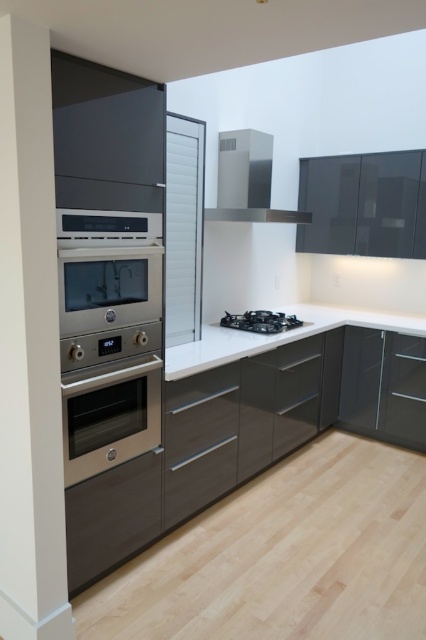
Does white glossy countertop at center appear over black matte stove at center?

No, white glossy countertop at center is not above black matte stove at center.

Consider the image. Does white glossy countertop at center have a lesser width compared to black matte stove at center?

In fact, white glossy countertop at center might be wider than black matte stove at center.

Who is more forward, [333,314] or [241,321]?

Point [241,321] is in front.

At what (x,y) coordinates should I click in order to perform the action: click on white glossy countertop at center. Please return your answer as a coordinate pair (x, y). The image size is (426, 640). Looking at the image, I should click on (276, 337).

Is point (115, 412) positioned in front of point (238, 332)?

That is True.

The width and height of the screenshot is (426, 640). Describe the element at coordinates (109, 416) in the screenshot. I see `stainless steel oven at center` at that location.

The width and height of the screenshot is (426, 640). What do you see at coordinates (109, 416) in the screenshot? I see `stainless steel oven at center` at bounding box center [109, 416].

Locate an element on the screen. The height and width of the screenshot is (640, 426). stainless steel oven at center is located at coordinates (109, 416).

Does white glossy countertop at center have a larger size compared to satin stainless steel exhaust hood at upper center?

Indeed, white glossy countertop at center has a larger size compared to satin stainless steel exhaust hood at upper center.

Who is higher up, white glossy countertop at center or satin stainless steel exhaust hood at upper center?

Positioned higher is satin stainless steel exhaust hood at upper center.

Locate an element on the screen. white glossy countertop at center is located at coordinates (276, 337).

Locate an element on the screen. Image resolution: width=426 pixels, height=640 pixels. white glossy countertop at center is located at coordinates (276, 337).